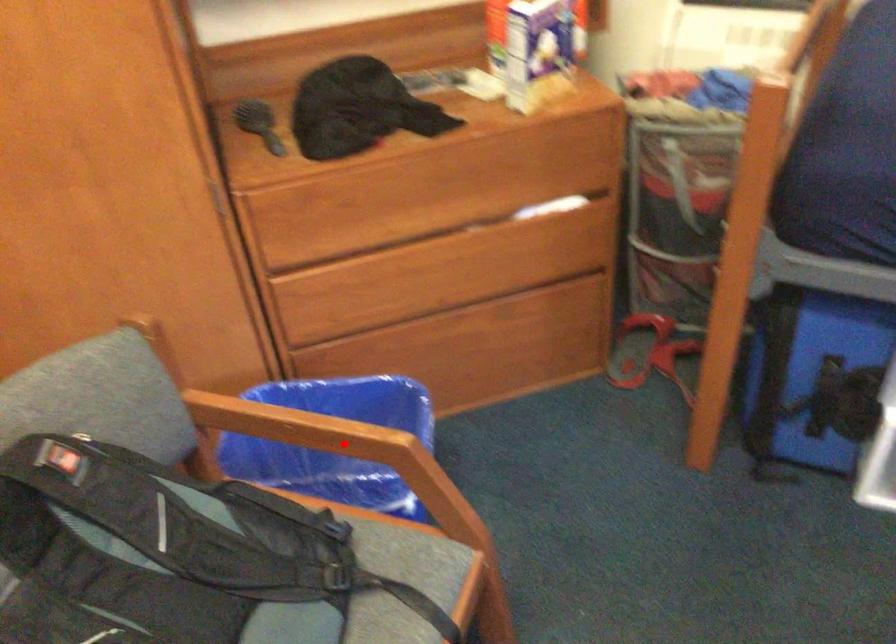
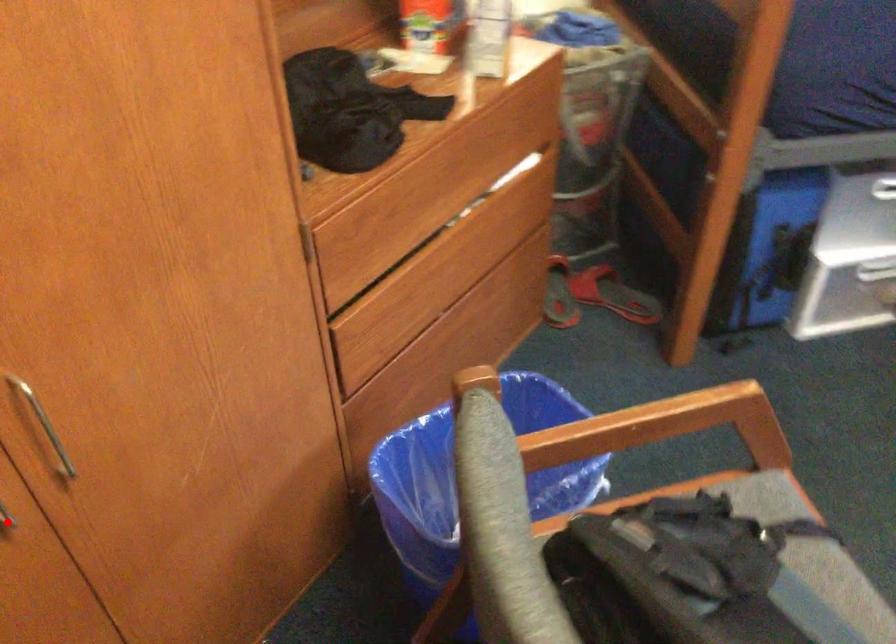
I am providing you with two images of the same scene from different viewpoints. A red point is marked on the first image and another point is marked on the second image. Does the point marked in image1 correspond to the same location as the one in image2?

No